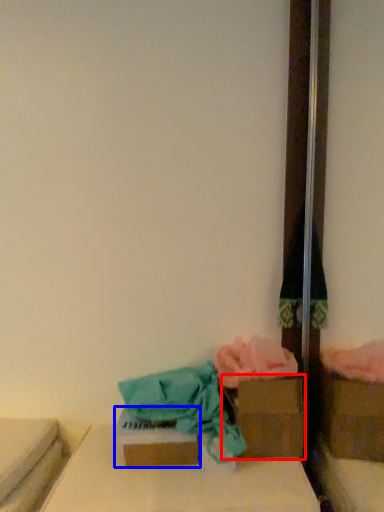
Question: Which object is further to the camera taking this photo, storage box (highlighted by a red box) or storage box (highlighted by a blue box)?

Choices:
 (A) storage box
 (B) storage box

Answer: (A)